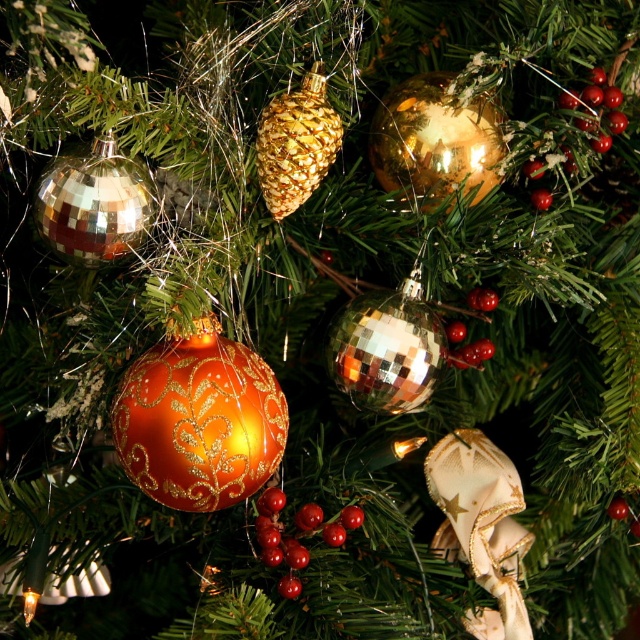
You are standing in front of the Christmas tree and want to reach the point at coordinates point (x=259, y=161). If your hand can extend 28 inches, will you be able to reach it?

The point (x=259, y=161) is 30.10 inches from the viewer. Since your hand can only extend 28 inches, you will not be able to reach it.

You are standing at a distance from the Christmas tree and want to know if you can reach the point at coordinates point (288, 120) with your hand. Your arm can extend 28 inches. Can you reach it?

The point (288, 120) is 29.33 inches away from you, which is slightly beyond your arm extension of 28 inches. Therefore, you cannot reach it with your hand.

You are standing in front of the Christmas tree and want to place a new decoration. You have two points marked on the tree where you can hang it. The first point is at coordinates point (275, 518) and the second is at point (468, 292). Which point is closer to you?

Point (275, 518) is in front of point (468, 292), so it is closer to you.